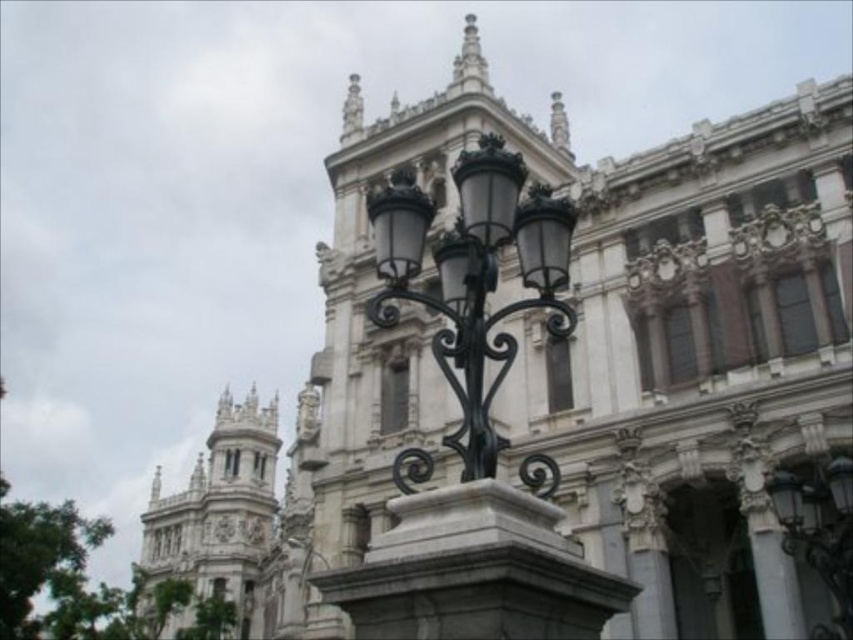
Is point (401, 248) positioned after point (260, 460)?

No, (401, 248) is closer to viewer.

Consider the image. Between polished black metal street light at center and white stone tower at upper left, which one is positioned higher?

polished black metal street light at center

Is point (514, 200) positioned behind point (222, 468)?

No, (514, 200) is in front of (222, 468).

Find the location of `polished black metal street light at center`. polished black metal street light at center is located at coordinates (473, 275).

Which is below, polished black metal street light at center or black metal/iron streetlight at right?

black metal/iron streetlight at right is below.

Who is positioned more to the right, polished black metal street light at center or black metal/iron streetlight at right?

Positioned to the right is black metal/iron streetlight at right.

Who is more forward, (x=380, y=221) or (x=838, y=502)?

Point (x=380, y=221)

The image size is (853, 640). What are the coordinates of `polished black metal street light at center` in the screenshot? It's located at (473, 275).

Looking at this image, can you confirm if white stone tower at upper left is positioned below black metal/iron streetlight at right?

Yes.

Can you confirm if white stone tower at upper left is taller than black metal/iron streetlight at right?

Yes.

What do you see at coordinates (219, 508) in the screenshot? I see `white stone tower at upper left` at bounding box center [219, 508].

Identify the location of white stone tower at upper left. The height and width of the screenshot is (640, 853). (219, 508).